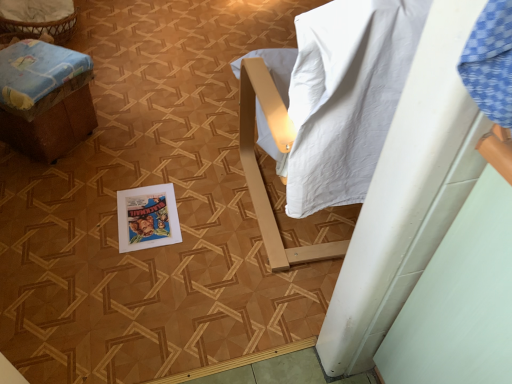
You are a GUI agent. You are given a task and a screenshot of the screen. Output one action in this format:
    pyautogui.click(x=<x>, y=<y>)
    Task: Click on the vacant region above vivid poster at center (from a real-world perspective)
    
    Given the screenshot: What is the action you would take?
    pyautogui.click(x=148, y=216)